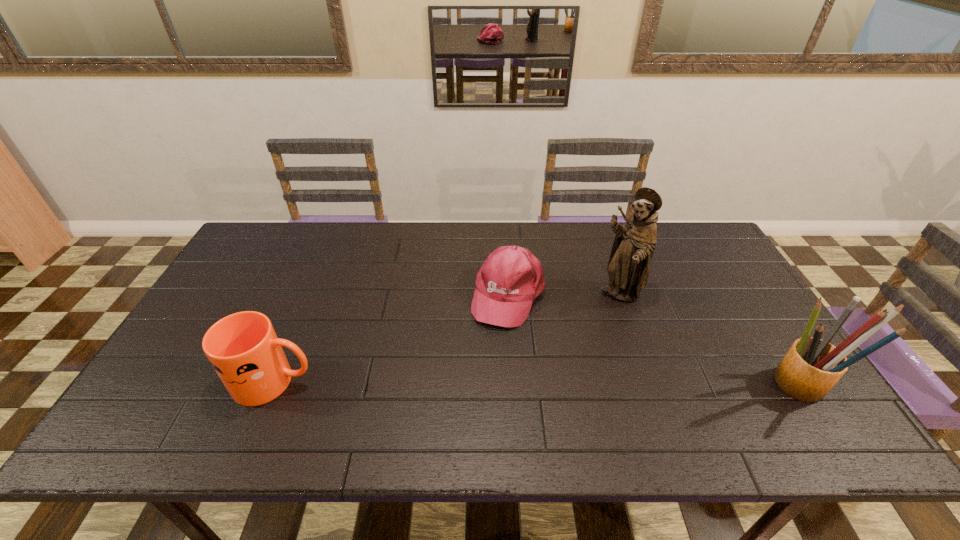
At what (x,y) coordinates should I click in order to perform the action: click on free space that is in between the figurine and the second tallest object. Please return your answer as a coordinate pair (x, y). Image resolution: width=960 pixels, height=540 pixels. Looking at the image, I should click on (708, 339).

You are a GUI agent. You are given a task and a screenshot of the screen. Output one action in this format:
    pyautogui.click(x=<x>, y=<y>)
    Task: Click on the vacant area that lies between the pencil box and the tallest object
    
    Given the screenshot: What is the action you would take?
    pyautogui.click(x=708, y=339)

Locate an element on the screen. This screenshot has height=540, width=960. vacant space that is in between the leftmost object and the pencil box is located at coordinates (537, 383).

Find the location of `free spot between the pencil box and the tallest object`. free spot between the pencil box and the tallest object is located at coordinates (708, 339).

Where is `blank region between the second object from right to left and the third object from right to left`? The width and height of the screenshot is (960, 540). blank region between the second object from right to left and the third object from right to left is located at coordinates (564, 294).

Where is `empty space that is in between the rightmost object and the tallest object`? empty space that is in between the rightmost object and the tallest object is located at coordinates [x=708, y=339].

This screenshot has width=960, height=540. What are the coordinates of `free space between the pencil box and the baseball cap` in the screenshot? It's located at (653, 339).

At what (x,y) coordinates should I click in order to perform the action: click on free point between the baseball cap and the tallest object. Please return your answer as a coordinate pair (x, y). This screenshot has width=960, height=540. Looking at the image, I should click on (564, 294).

Image resolution: width=960 pixels, height=540 pixels. Identify the location of object that is the nearest to the tallest object. (511, 277).

Select which object appears as the closest to the baseball cap. Please provide its 2D coordinates. Your answer should be formatted as a tuple, i.e. [(x, y)], where the tuple contains the x and y coordinates of a point satisfying the conditions above.

[(628, 267)]